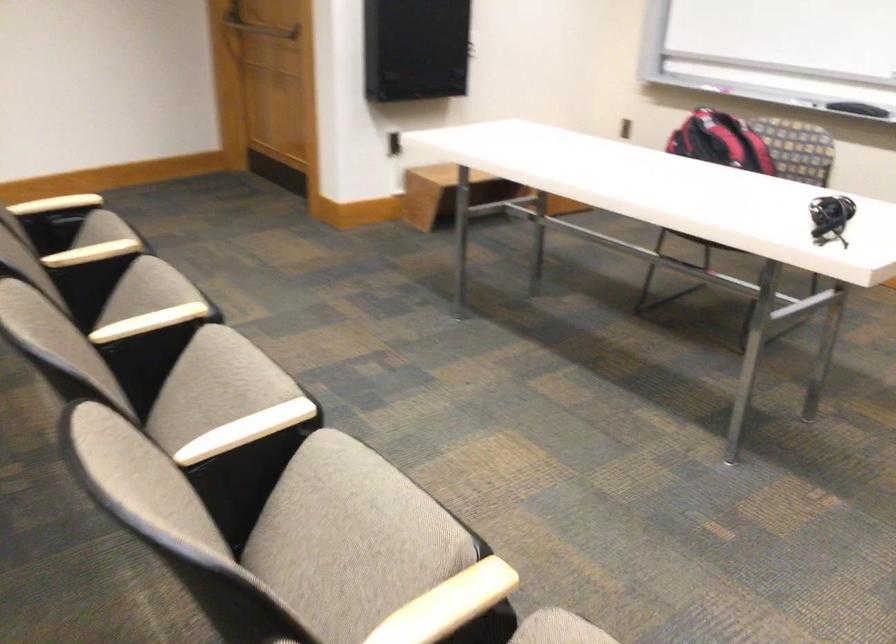
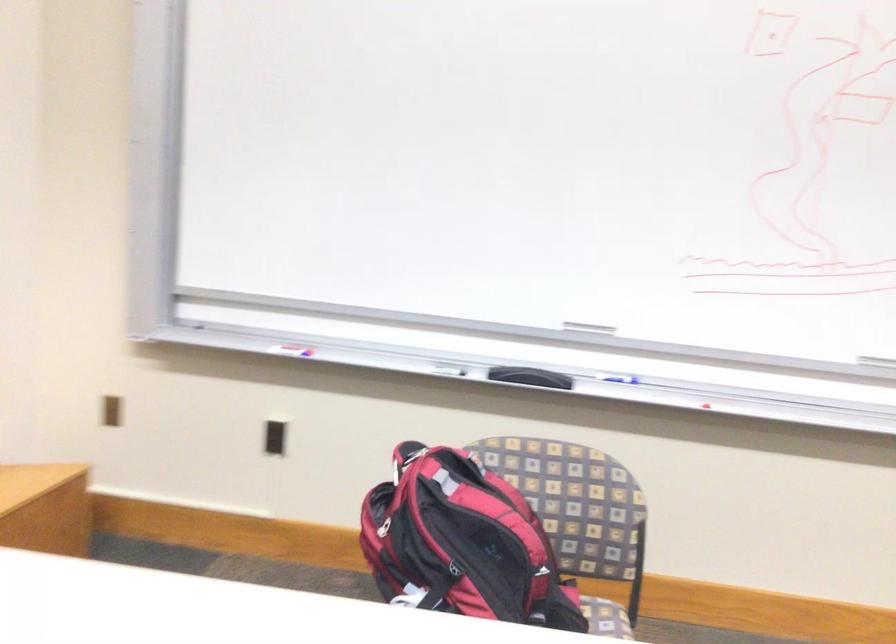
Where in the second image is the point corresponding to point 679,136 from the first image?

(383, 527)